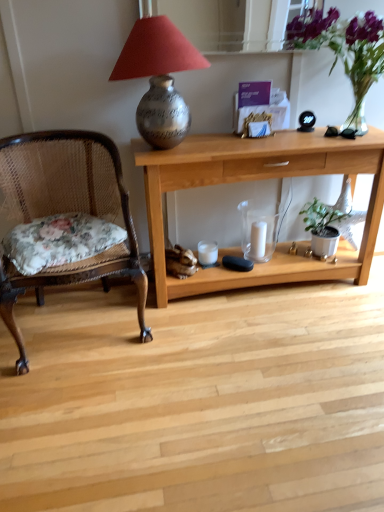
This screenshot has height=512, width=384. Find the location of `free location to the left of purple glass vase at upper right`. free location to the left of purple glass vase at upper right is located at coordinates (267, 141).